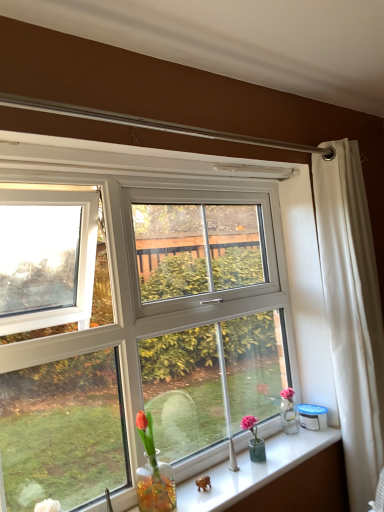
Question: Does white fabric curtain at right have a larger size compared to clear glass vase at lower center?

Choices:
 (A) yes
 (B) no

Answer: (A)

Question: Is white fabric curtain at right taller than clear glass vase at lower center?

Choices:
 (A) yes
 (B) no

Answer: (A)

Question: Can you confirm if white fabric curtain at right is shorter than clear glass vase at lower center?

Choices:
 (A) no
 (B) yes

Answer: (A)

Question: From a real-world perspective, does white fabric curtain at right sit lower than clear glass vase at lower center?

Choices:
 (A) no
 (B) yes

Answer: (A)

Question: Can you confirm if white fabric curtain at right is thinner than clear glass vase at lower center?

Choices:
 (A) yes
 (B) no

Answer: (A)

Question: Is white fabric curtain at right oriented away from clear glass vase at lower center?

Choices:
 (A) yes
 (B) no

Answer: (B)

Question: Considering the relative sizes of clear glass vase at lower center and white fabric curtain at right in the image provided, is clear glass vase at lower center shorter than white fabric curtain at right?

Choices:
 (A) yes
 (B) no

Answer: (A)

Question: From a real-world perspective, does clear glass vase at lower center stand above white fabric curtain at right?

Choices:
 (A) no
 (B) yes

Answer: (A)

Question: Considering the relative positions of clear glass vase at lower center and white fabric curtain at right in the image provided, is clear glass vase at lower center to the left of white fabric curtain at right from the viewer's perspective?

Choices:
 (A) no
 (B) yes

Answer: (B)

Question: Is clear glass vase at lower center oriented towards white fabric curtain at right?

Choices:
 (A) yes
 (B) no

Answer: (B)

Question: Is clear glass vase at lower center oriented away from white fabric curtain at right?

Choices:
 (A) no
 (B) yes

Answer: (A)

Question: Considering the relative sizes of clear glass vase at lower center and white fabric curtain at right in the image provided, is clear glass vase at lower center smaller than white fabric curtain at right?

Choices:
 (A) yes
 (B) no

Answer: (A)

Question: Does point (327, 298) appear closer or farther from the camera than point (248, 459)?

Choices:
 (A) closer
 (B) farther

Answer: (B)